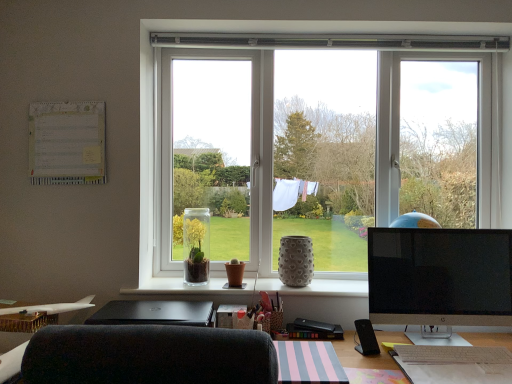
Where is `free spot to the left of gray textured vase at center, which is the 1th vase from right to left`? The image size is (512, 384). free spot to the left of gray textured vase at center, which is the 1th vase from right to left is located at coordinates (264, 286).